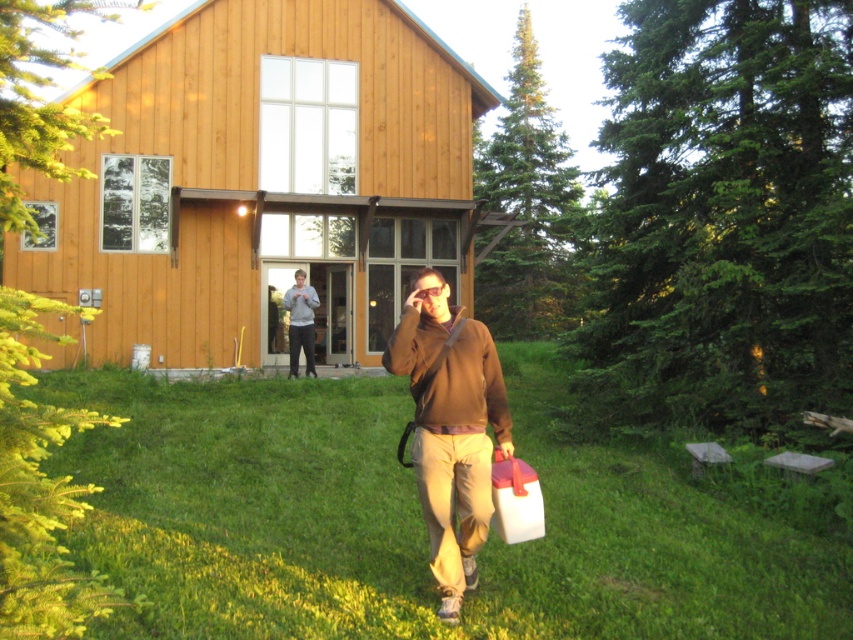
Consider the image. Is green grass at center wider than gray cotton sweatshirt at center?

Yes, green grass at center is wider than gray cotton sweatshirt at center.

Can you confirm if green grass at center is positioned below gray cotton sweatshirt at center?

Yes, green grass at center is below gray cotton sweatshirt at center.

Measure the distance between green grass at center and camera.

A distance of 3.75 meters exists between green grass at center and camera.

The height and width of the screenshot is (640, 853). Find the location of `green grass at center`. green grass at center is located at coordinates (407, 522).

Does green grass at center appear over wooden cabin at center?

No.

Is green grass at center closer to the viewer compared to wooden cabin at center?

Yes, it is in front of wooden cabin at center.

Is point (289, 600) behind point (448, 195)?

No, (289, 600) is in front of (448, 195).

The image size is (853, 640). Identify the location of green grass at center. (407, 522).

Find the location of `wooden cabin at center`. wooden cabin at center is located at coordinates (260, 182).

Is point (318, 260) positioned behind point (454, 356)?

That is True.

Where is `wooden cabin at center`? This screenshot has height=640, width=853. wooden cabin at center is located at coordinates (260, 182).